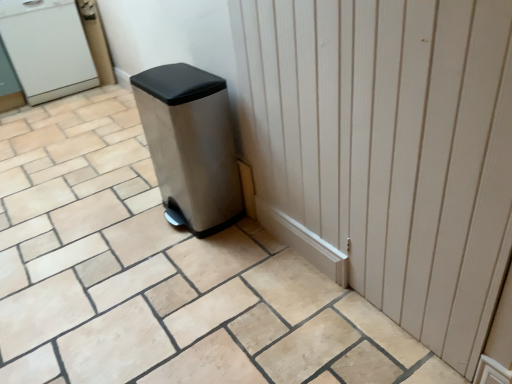
Question: Considering the relative sizes of stainless steel trash can at center and white matte water cooler at upper left in the image provided, is stainless steel trash can at center shorter than white matte water cooler at upper left?

Choices:
 (A) no
 (B) yes

Answer: (B)

Question: Considering the relative sizes of stainless steel trash can at center and white matte water cooler at upper left in the image provided, is stainless steel trash can at center wider than white matte water cooler at upper left?

Choices:
 (A) yes
 (B) no

Answer: (B)

Question: Is the position of stainless steel trash can at center more distant than that of white matte water cooler at upper left?

Choices:
 (A) no
 (B) yes

Answer: (A)

Question: Can white matte water cooler at upper left be found inside stainless steel trash can at center?

Choices:
 (A) no
 (B) yes

Answer: (A)

Question: Can you confirm if stainless steel trash can at center is thinner than white matte water cooler at upper left?

Choices:
 (A) yes
 (B) no

Answer: (A)

Question: From the image's perspective, relative to beige ceramic tile at center, is white wood door at center above or below?

Choices:
 (A) below
 (B) above

Answer: (B)

Question: Is point (474, 87) positioned closer to the camera than point (266, 246)?

Choices:
 (A) farther
 (B) closer

Answer: (B)

Question: Relative to beige ceramic tile at center, is white wood door at center in front or behind?

Choices:
 (A) front
 (B) behind

Answer: (B)

Question: In terms of height, does white wood door at center look taller or shorter compared to beige ceramic tile at center?

Choices:
 (A) tall
 (B) short

Answer: (A)

Question: Looking at the image, does white wood door at center seem bigger or smaller compared to stainless steel trash can at center?

Choices:
 (A) big
 (B) small

Answer: (B)

Question: Which is correct: white wood door at center is inside stainless steel trash can at center, or outside of it?

Choices:
 (A) inside
 (B) outside

Answer: (B)

Question: From the image's perspective, is white wood door at center located above or below stainless steel trash can at center?

Choices:
 (A) above
 (B) below

Answer: (B)

Question: From a real-world perspective, relative to stainless steel trash can at center, is white wood door at center vertically above or below?

Choices:
 (A) above
 (B) below

Answer: (A)

Question: Relative to white wood door at center, is white matte water cooler at upper left in front or behind?

Choices:
 (A) front
 (B) behind

Answer: (B)

Question: Is white matte water cooler at upper left wider or thinner than white wood door at center?

Choices:
 (A) thin
 (B) wide

Answer: (B)